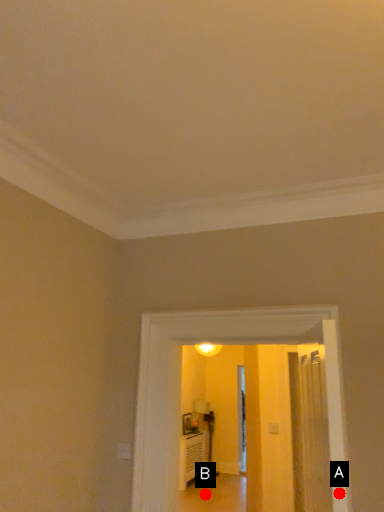
Question: Two points are circled on the image, labeled by A and B beside each circle. Which point appears farthest from the camera in this image?

Choices:
 (A) A is further
 (B) B is further

Answer: (B)